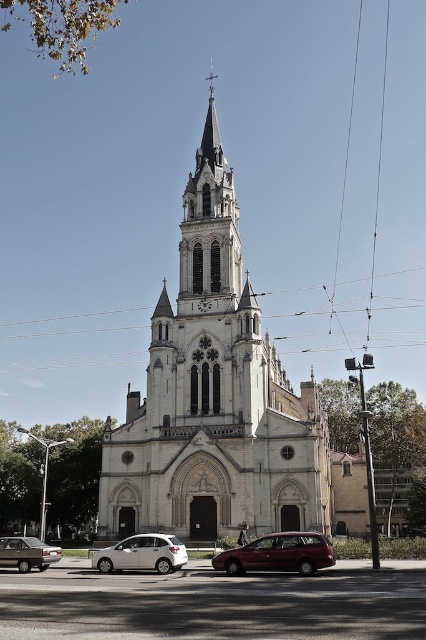
You are standing in front of the white stone church at center and want to take a photo that captures the entire building. Considering the distance between you and the church, what is the minimum focal length required for your camera lens to fit the church in the frame?

The minimum focal length required would depend on the sensor size of your camera and the desired field of view. However, since the distance between you and the white stone church at center is 213.29 feet, a wide angle lens is recommended to capture the entire structure in the frame.

You are standing at the point marked as point (314, 493) in the image, which is 65.80 meters away from the camera. You want to take a photo of the grand Gothic church with its central spire and flanking towers clearly visible. Is your current position far enough to capture the entire church structure in one shot?

The point (314, 493) is 65.80 meters away from the camera. Since the church has a grand structure with a central spire and two smaller towers, this distance should be sufficient to capture the entire church in one shot, assuming the camera has an appropriate wide angle lens.

From the picture: Based on the coordinates provided, which object is located at point (213,396) in the image?

The point (213,396) indicates the white stone church at center.